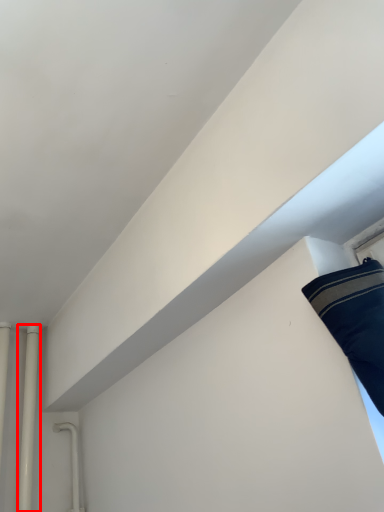
Question: From the image's perspective, what is the correct spatial positioning of pipe (annotated by the red box) in reference to pipe?

Choices:
 (A) above
 (B) below

Answer: (B)